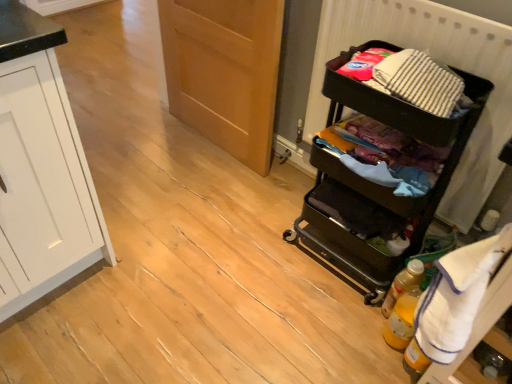
This screenshot has height=384, width=512. I want to click on black plastic cart at right, so click(377, 185).

How much space does translucent yellow bottle at lower right, arranged as the 2th bottle when viewed from the back, occupy vertically?

10.60 inches.

Image resolution: width=512 pixels, height=384 pixels. Identify the location of translucent yellow bottle at lower right, placed as the first bottle when sorted from front to back. (401, 320).

Locate an element on the screen. This screenshot has width=512, height=384. striped cotton laundry at right is located at coordinates (385, 155).

Describe the element at coordinates (224, 71) in the screenshot. I see `wooden door at center` at that location.

The image size is (512, 384). I want to click on black plastic cart at right, so click(x=377, y=185).

Is point (371, 254) closer or farther from the camera than point (416, 270)?

Point (371, 254) is positioned farther from the camera compared to point (416, 270).

Is black plastic cart at right surrounding translucent yellow bottle at lower right, marked as the second bottle in a front-to-back arrangement?

No, translucent yellow bottle at lower right, marked as the second bottle in a front-to-back arrangement, is located outside of black plastic cart at right.

Consider the image. Is black plastic cart at right to the left of translucent yellow bottle at lower right, the first bottle viewed from the back, from the viewer's perspective?

Indeed, black plastic cart at right is positioned on the left side of translucent yellow bottle at lower right, the first bottle viewed from the back.

Is black plastic cart at right behind translucent yellow bottle at lower right, marked as the second bottle in a front-to-back arrangement?

No, black plastic cart at right is closer to the viewer.

Relative to white terry cloth towel at right, is wooden door at center in front or behind?

wooden door at center is behind white terry cloth towel at right.

How different are the orientations of wooden door at center and white terry cloth towel at right in degrees?

wooden door at center and white terry cloth towel at right are facing 89.2 degrees away from each other.

From a real-world perspective, is wooden door at center beneath white terry cloth towel at right?

Yes, from a real-world perspective, wooden door at center is below white terry cloth towel at right.

I want to click on door above the white terry cloth towel at right (from the image's perspective), so click(x=224, y=71).

Is white terry cloth towel at right shorter than wooden door at center?

Yes.

From the image's perspective, between white terry cloth towel at right and wooden door at center, which one is located above?

wooden door at center is shown above in the image.

Locate an element on the screen. Image resolution: width=512 pixels, height=384 pixels. door below the white terry cloth towel at right (from a real-world perspective) is located at coordinates (224, 71).

Is point (426, 354) farther from viewer compared to point (238, 83)?

No, it is in front of (238, 83).

Measure the distance from translucent yellow bottle at lower right, placed as the first bottle when sorted from front to back, to wooden door at center.

translucent yellow bottle at lower right, placed as the first bottle when sorted from front to back, and wooden door at center are 1.21 meters apart from each other.

Is translucent yellow bottle at lower right, placed as the first bottle when sorted from front to back, at the left side of wooden door at center?

No, translucent yellow bottle at lower right, placed as the first bottle when sorted from front to back, is not to the left of wooden door at center.

Is translucent yellow bottle at lower right, placed as the first bottle when sorted from front to back, wider or thinner than wooden door at center?

translucent yellow bottle at lower right, placed as the first bottle when sorted from front to back, is thinner than wooden door at center.

Is translucent yellow bottle at lower right, arranged as the 2th bottle when viewed from the back, facing away from wooden door at center?

No, translucent yellow bottle at lower right, arranged as the 2th bottle when viewed from the back,'s orientation is not away from wooden door at center.

Is white terry cloth towel at right oriented away from translucent yellow bottle at lower right, marked as the second bottle in a front-to-back arrangement?

No, white terry cloth towel at right's orientation is not away from translucent yellow bottle at lower right, marked as the second bottle in a front-to-back arrangement.

Is the position of white terry cloth towel at right more distant than that of translucent yellow bottle at lower right, the first bottle viewed from the back?

No, white terry cloth towel at right is in front of translucent yellow bottle at lower right, the first bottle viewed from the back.

From the image's perspective, is white terry cloth towel at right located beneath translucent yellow bottle at lower right, marked as the second bottle in a front-to-back arrangement?

Actually, white terry cloth towel at right appears above translucent yellow bottle at lower right, marked as the second bottle in a front-to-back arrangement, in the image.

From a real-world perspective, relative to translucent yellow bottle at lower right, the first bottle viewed from the back, is white terry cloth towel at right vertically above or below?

In terms of real-world spatial position, white terry cloth towel at right is above translucent yellow bottle at lower right, the first bottle viewed from the back.

Considering the sizes of striped cotton laundry at right and translucent yellow bottle at lower right, arranged as the 2th bottle when viewed from the back, in the image, is striped cotton laundry at right wider or thinner than translucent yellow bottle at lower right, arranged as the 2th bottle when viewed from the back,?

Clearly, striped cotton laundry at right has more width compared to translucent yellow bottle at lower right, arranged as the 2th bottle when viewed from the back.

How distant is striped cotton laundry at right from translucent yellow bottle at lower right, placed as the first bottle when sorted from front to back?

striped cotton laundry at right is 18.50 inches from translucent yellow bottle at lower right, placed as the first bottle when sorted from front to back.

From the image's perspective, does striped cotton laundry at right appear higher than translucent yellow bottle at lower right, arranged as the 2th bottle when viewed from the back?

Correct, striped cotton laundry at right appears higher than translucent yellow bottle at lower right, arranged as the 2th bottle when viewed from the back, in the image.

This screenshot has height=384, width=512. I want to click on bottle that is the 1st object to the right of the striped cotton laundry at right, starting at the anchor, so click(401, 320).

Is point (343, 248) positioned after point (404, 318)?

Yes, point (343, 248) is behind point (404, 318).

Find the location of a particular element. The height and width of the screenshot is (384, 512). the 1st bottle counting from the right side of the black plastic cart at right is located at coordinates (401, 320).

From the picture: From the image's perspective, is black plastic cart at right located above or below translucent yellow bottle at lower right, placed as the first bottle when sorted from front to back?

Clearly, from the image's perspective, black plastic cart at right is above translucent yellow bottle at lower right, placed as the first bottle when sorted from front to back.

Considering the sizes of objects black plastic cart at right and translucent yellow bottle at lower right, arranged as the 2th bottle when viewed from the back, in the image provided, who is bigger, black plastic cart at right or translucent yellow bottle at lower right, arranged as the 2th bottle when viewed from the back,?

black plastic cart at right.

Which bottle is the 2nd one when counting from the right side of the black plastic cart at right? Please provide its 2D coordinates.

[(403, 284)]

Where is `door above the white terry cloth towel at right (from the image's perspective)`? The width and height of the screenshot is (512, 384). door above the white terry cloth towel at right (from the image's perspective) is located at coordinates (224, 71).

Which object lies further to the anchor point translucent yellow bottle at lower right, the first bottle viewed from the back, wooden door at center or striped cotton laundry at right?

wooden door at center lies further to translucent yellow bottle at lower right, the first bottle viewed from the back, than the other object.

From the picture: When comparing their distances from white terry cloth towel at right, does black plastic cart at right or striped cotton laundry at right seem closer?

striped cotton laundry at right is closer to white terry cloth towel at right.

Based on their spatial positions, is striped cotton laundry at right or translucent yellow bottle at lower right, placed as the first bottle when sorted from front to back, closer to wooden door at center?

Based on the image, striped cotton laundry at right appears to be nearer to wooden door at center.

From the picture: When comparing their distances from black plastic cart at right, does translucent yellow bottle at lower right, marked as the second bottle in a front-to-back arrangement, or translucent yellow bottle at lower right, placed as the first bottle when sorted from front to back, seem closer?

The object closer to black plastic cart at right is translucent yellow bottle at lower right, marked as the second bottle in a front-to-back arrangement.

From the image, which object appears to be nearer to white terry cloth towel at right, translucent yellow bottle at lower right, the first bottle viewed from the back, or black plastic cart at right?

Based on the image, translucent yellow bottle at lower right, the first bottle viewed from the back, appears to be nearer to white terry cloth towel at right.

Which object lies further to the anchor point black plastic cart at right, translucent yellow bottle at lower right, placed as the first bottle when sorted from front to back, or wooden door at center?

The object further to black plastic cart at right is wooden door at center.

Considering their positions, is black plastic cart at right positioned further to white terry cloth towel at right than translucent yellow bottle at lower right, placed as the first bottle when sorted from front to back?

black plastic cart at right lies further to white terry cloth towel at right than the other object.

Based on their spatial positions, is white terry cloth towel at right or translucent yellow bottle at lower right, marked as the second bottle in a front-to-back arrangement, further from striped cotton laundry at right?

translucent yellow bottle at lower right, marked as the second bottle in a front-to-back arrangement.

Locate an element on the screen. clothing between striped cotton laundry at right and translucent yellow bottle at lower right, arranged as the 2th bottle when viewed from the back, from top to bottom is located at coordinates (457, 296).

At what (x,y) coordinates should I click in order to perform the action: click on clothing between black plastic cart at right and translucent yellow bottle at lower right, arranged as the 2th bottle when viewed from the back, from top to bottom. Please return your answer as a coordinate pair (x, y). This screenshot has width=512, height=384. Looking at the image, I should click on (457, 296).

You are a GUI agent. You are given a task and a screenshot of the screen. Output one action in this format:
    pyautogui.click(x=<x>, y=<y>)
    Task: Click on the bottle between black plastic cart at right and translucent yellow bottle at lower right, arranged as the 2th bottle when viewed from the back, in the up-down direction
    Image resolution: width=512 pixels, height=384 pixels.
    Given the screenshot: What is the action you would take?
    pyautogui.click(x=403, y=284)

At what (x,y) coordinates should I click in order to perform the action: click on furniture between wooden door at center and translucent yellow bottle at lower right, placed as the first bottle when sorted from front to back, vertically. Please return your answer as a coordinate pair (x, y). The image size is (512, 384). Looking at the image, I should click on (377, 185).